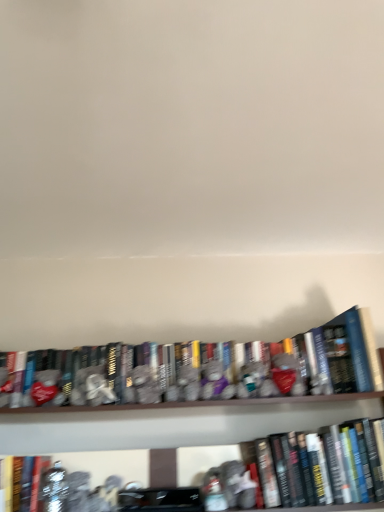
Question: Considering the positions of point (6, 473) and point (340, 335), is point (6, 473) closer or farther from the camera than point (340, 335)?

Choices:
 (A) closer
 (B) farther

Answer: (A)

Question: From a real-world perspective, is hardcover book at lower left, placed as the 3th book when sorted from right to left, physically located above or below hardcover books at center, the second book from the left?

Choices:
 (A) above
 (B) below

Answer: (B)

Question: Estimate the real-world distances between objects in this image. Which object is farther from the hardcover books at center, the second book from the left?

Choices:
 (A) hardcover book at lower left, marked as the first book in a left-to-right arrangement
 (B) hardcover book at center, which appears as the first book when viewed from the right

Answer: (A)

Question: Which object is the farthest from the hardcover book at lower left, marked as the first book in a left-to-right arrangement?

Choices:
 (A) hardcover books at center, the second book from the left
 (B) hardcover book at center, which appears as the first book when viewed from the right

Answer: (B)